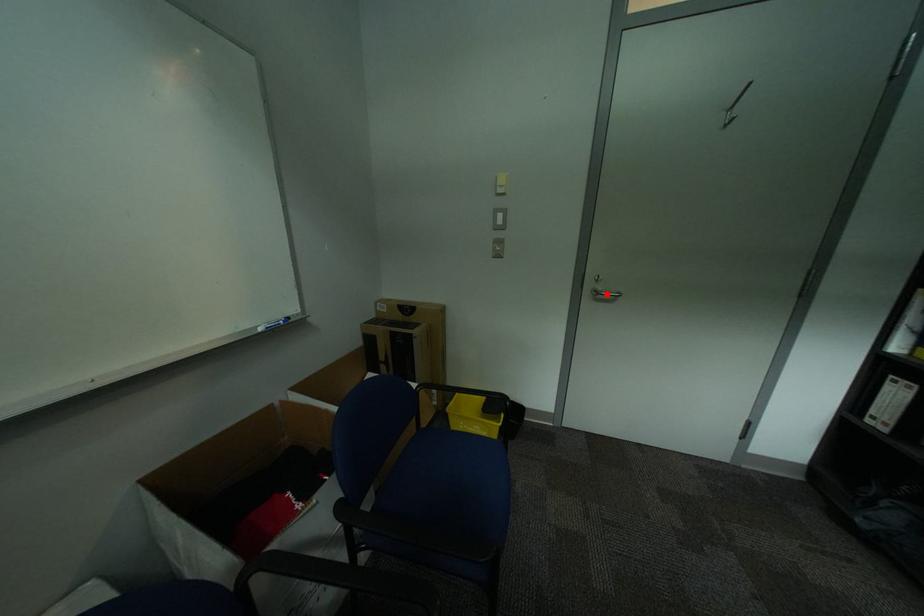
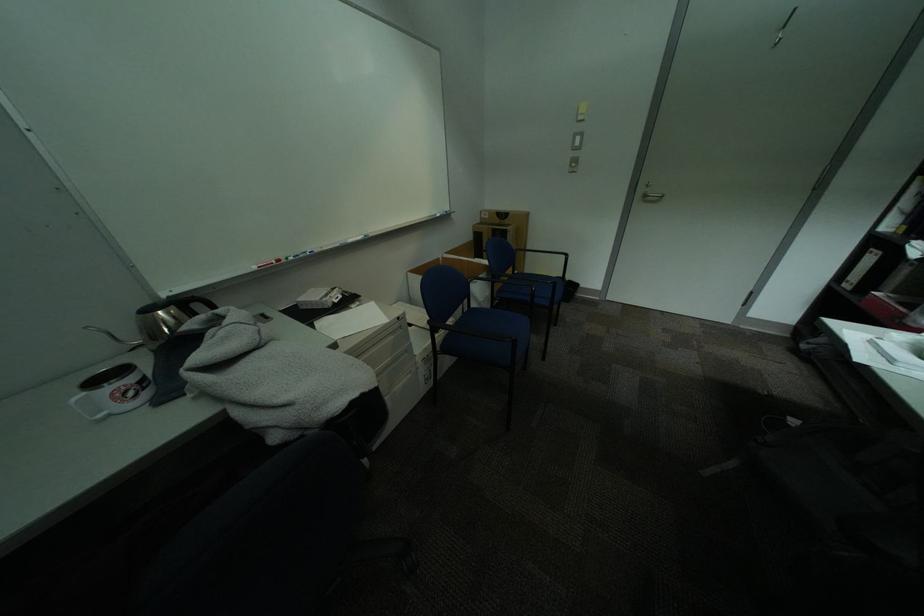
Where in the second image is the point corresponding to the highlighted location from the first image?

(655, 197)